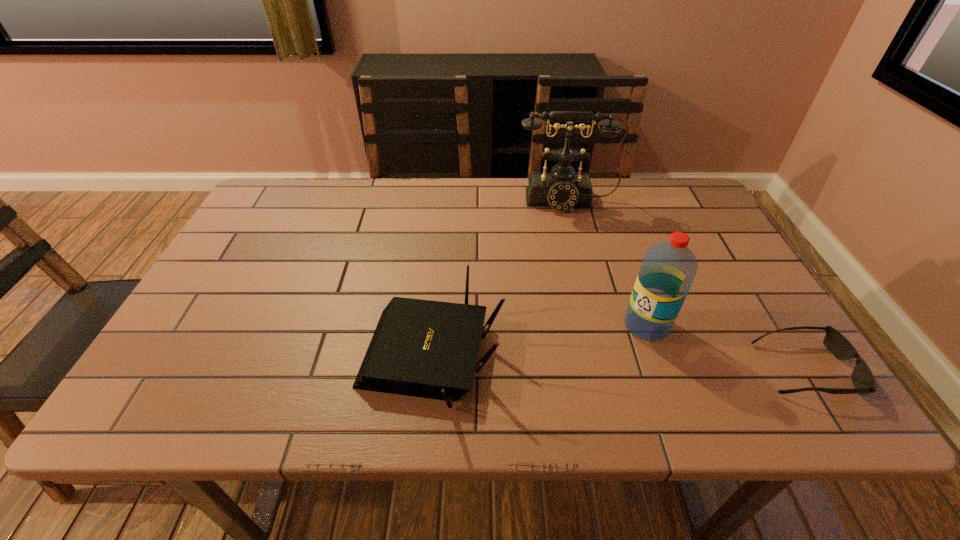
This screenshot has height=540, width=960. Identify the location of vacant area that lies between the sunglasses and the router. (618, 364).

Locate an element on the screen. The image size is (960, 540). free area in between the water bottle and the farthest object is located at coordinates (607, 263).

Locate an element on the screen. object that is the second closest one to the farthest object is located at coordinates (668, 269).

The image size is (960, 540). In order to click on object that is the closest to the sunglasses in this screenshot , I will do `click(668, 269)`.

Where is `vacant space that satisfies the following two spatial constraints: 1. on the front side of the rightmost object; 2. on the front-facing side of the water bottle`? vacant space that satisfies the following two spatial constraints: 1. on the front side of the rightmost object; 2. on the front-facing side of the water bottle is located at coordinates point(661,369).

You are a GUI agent. You are given a task and a screenshot of the screen. Output one action in this format:
    pyautogui.click(x=<x>, y=<y>)
    Task: Click on the free location that satisfies the following two spatial constraints: 1. on the back side of the router; 2. on the left side of the farthest object
    
    Given the screenshot: What is the action you would take?
    coord(446,201)

Image resolution: width=960 pixels, height=540 pixels. I want to click on free spot that satisfies the following two spatial constraints: 1. on the front side of the farthest object; 2. on the front-facing side of the sunglasses, so click(x=608, y=369).

Locate an element on the screen. The image size is (960, 540). vacant position in the image that satisfies the following two spatial constraints: 1. on the front side of the water bottle; 2. on the front-facing side of the rightmost object is located at coordinates (661, 369).

Find the location of `vacant position in the image that satisfies the following two spatial constraints: 1. on the front side of the water bottle; 2. on the front-facing side of the sunglasses`. vacant position in the image that satisfies the following two spatial constraints: 1. on the front side of the water bottle; 2. on the front-facing side of the sunglasses is located at coordinates (661, 369).

This screenshot has height=540, width=960. I want to click on free location that satisfies the following two spatial constraints: 1. on the front side of the telephone; 2. on the front-facing side of the sunglasses, so click(x=608, y=369).